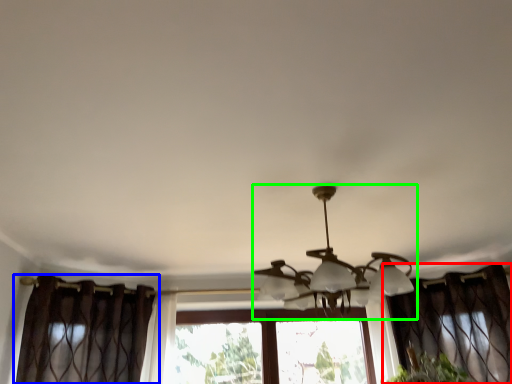
Question: Considering the real-world distances, which object is closest to curtain (highlighted by a red box)? curtain (highlighted by a blue box) or lamp (highlighted by a green box).

Choices:
 (A) curtain
 (B) lamp

Answer: (B)